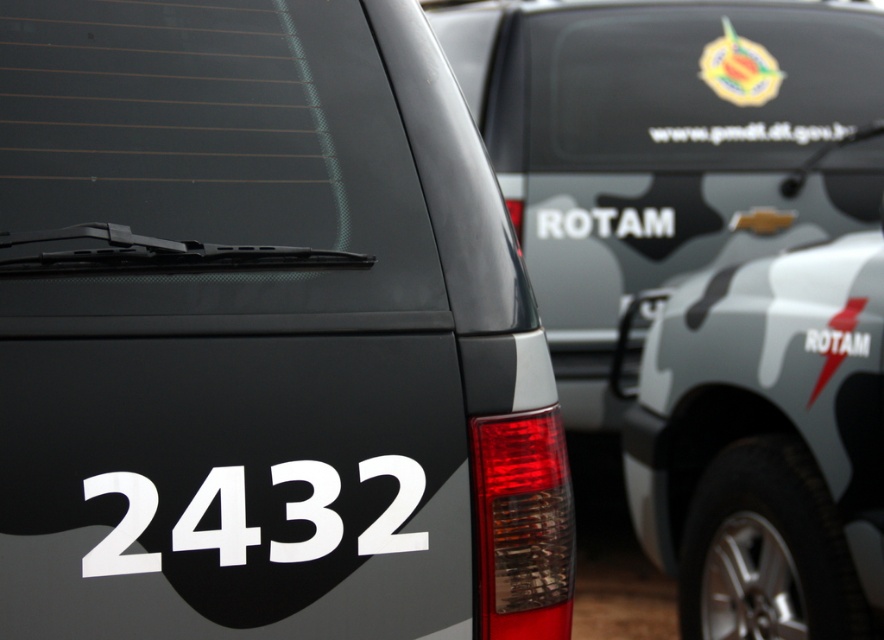
You are a ROTAM officer needing to secure the emblem for a mission. The emblem is metallic emblem at upper right. You are standing next to the matte black vehicle at center. Can you reach the emblem without moving the vehicle?

The distance between the matte black vehicle at center and the metallic emblem at upper right is 4.07 meters. Since the emblem is 4.07 meters away from the vehicle, you would need to move towards it to reach it, so you cannot secure it without moving the vehicle.

You are a ROTAM officer inspecting the vehicles. You need to determine which object is bigger between the metallic emblem at upper right and the white matte license plate at center. Which one is larger?

The metallic emblem at upper right is larger than the white matte license plate at center.